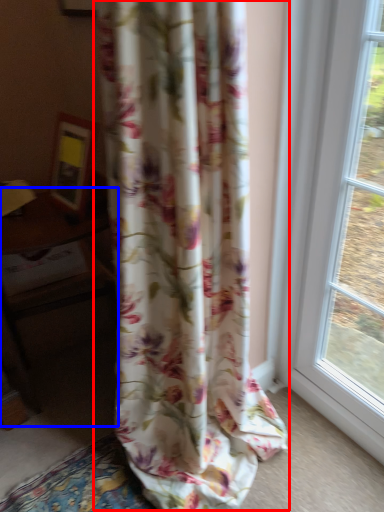
Question: Which object is further to the camera taking this photo, curtain (highlighted by a red box) or table (highlighted by a blue box)?

Choices:
 (A) curtain
 (B) table

Answer: (B)